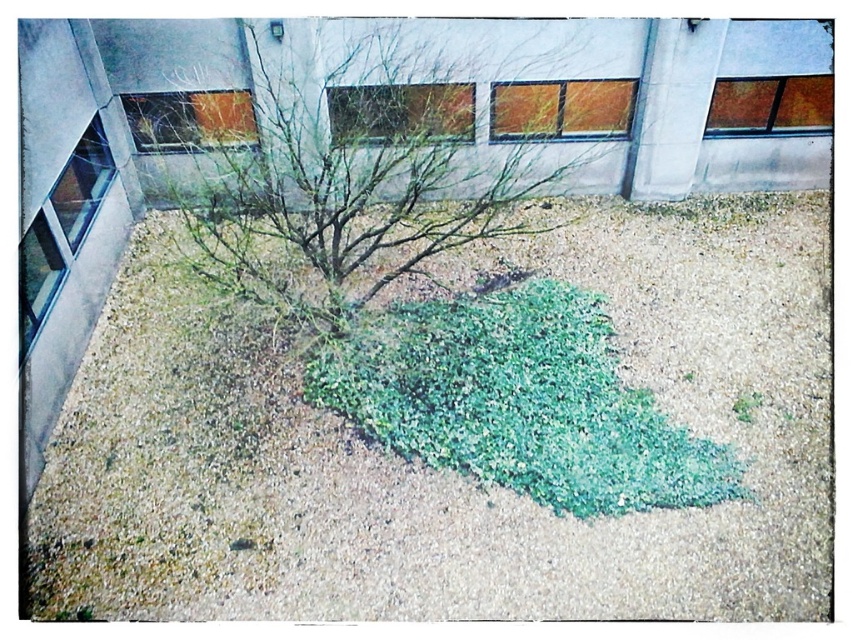
Is gray gravel at center positioned before bare branches at center?

Yes, gray gravel at center is closer to the viewer.

Is gray gravel at center bigger than bare branches at center?

Yes, gray gravel at center is bigger than bare branches at center.

The width and height of the screenshot is (853, 640). I want to click on gray gravel at center, so click(x=445, y=468).

At what (x,y) coordinates should I click in order to perform the action: click on gray gravel at center. Please return your answer as a coordinate pair (x, y). Looking at the image, I should click on (445, 468).